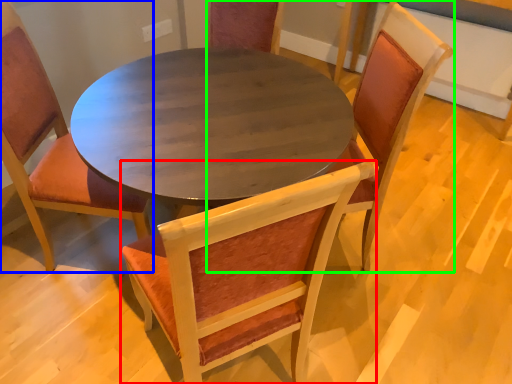
Question: Which is nearer to the chair (highlighted by a red box)? chair (highlighted by a blue box) or chair (highlighted by a green box).

Choices:
 (A) chair
 (B) chair

Answer: (A)